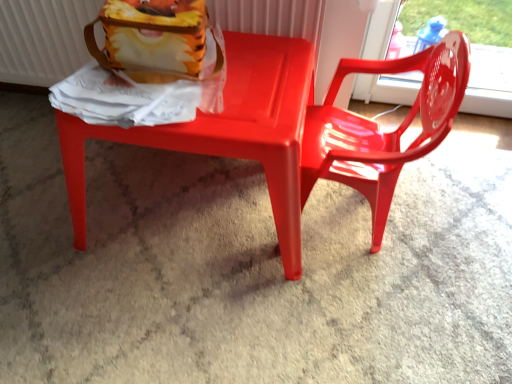
Question: Considering the relative positions of matte plastic chair at center, which is counted as the 1th chair, starting from the left, and matte white radiator at upper left in the image provided, is matte plastic chair at center, which is counted as the 1th chair, starting from the left, to the right of matte white radiator at upper left from the viewer's perspective?

Choices:
 (A) no
 (B) yes

Answer: (B)

Question: From the image's perspective, would you say matte plastic chair at center, which is counted as the 1th chair, starting from the left, is shown under matte white radiator at upper left?

Choices:
 (A) yes
 (B) no

Answer: (A)

Question: Considering the relative positions of matte plastic chair at center, the 2th chair positioned from the right, and matte white radiator at upper left in the image provided, is matte plastic chair at center, the 2th chair positioned from the right, to the left of matte white radiator at upper left from the viewer's perspective?

Choices:
 (A) no
 (B) yes

Answer: (A)

Question: Can you confirm if matte plastic chair at center, which is counted as the 1th chair, starting from the left, is wider than matte white radiator at upper left?

Choices:
 (A) no
 (B) yes

Answer: (B)

Question: From a real-world perspective, is matte plastic chair at center, which is counted as the 1th chair, starting from the left, over matte white radiator at upper left?

Choices:
 (A) no
 (B) yes

Answer: (A)

Question: From a real-world perspective, is matte white radiator at upper left physically located above or below matte plastic chair at center, the 2th chair positioned from the right?

Choices:
 (A) below
 (B) above

Answer: (B)

Question: Considering the positions of matte white radiator at upper left and matte plastic chair at center, which is counted as the 1th chair, starting from the left, in the image, is matte white radiator at upper left taller or shorter than matte plastic chair at center, which is counted as the 1th chair, starting from the left,?

Choices:
 (A) tall
 (B) short

Answer: (B)

Question: From the image's perspective, relative to matte plastic chair at center, which is counted as the 1th chair, starting from the left, is matte white radiator at upper left above or below?

Choices:
 (A) above
 (B) below

Answer: (A)

Question: Relative to matte plastic chair at center, which is counted as the 1th chair, starting from the left, is matte white radiator at upper left in front or behind?

Choices:
 (A) behind
 (B) front

Answer: (A)

Question: Is point (442, 62) positioned closer to the camera than point (315, 11)?

Choices:
 (A) closer
 (B) farther

Answer: (A)

Question: Which is correct: glossy plastic chair at center, the first chair positioned from the right, is inside matte white radiator at upper left, or outside of it?

Choices:
 (A) outside
 (B) inside

Answer: (A)

Question: In terms of height, does glossy plastic chair at center, which is the second chair in left-to-right order, look taller or shorter compared to matte white radiator at upper left?

Choices:
 (A) short
 (B) tall

Answer: (B)

Question: In the image, is glossy plastic chair at center, which is the second chair in left-to-right order, positioned in front of or behind matte white radiator at upper left?

Choices:
 (A) front
 (B) behind

Answer: (A)

Question: Considering the positions of point (75, 62) and point (378, 165), is point (75, 62) closer or farther from the camera than point (378, 165)?

Choices:
 (A) farther
 (B) closer

Answer: (A)

Question: From a real-world perspective, is matte white radiator at upper left positioned above or below glossy plastic chair at center, which is the second chair in left-to-right order?

Choices:
 (A) below
 (B) above

Answer: (B)